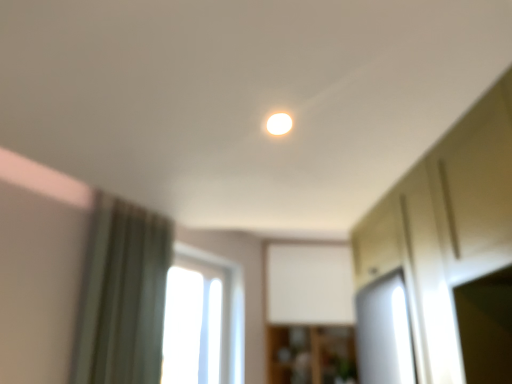
The image size is (512, 384). Identify the location of matte white light at center. (279, 124).

Image resolution: width=512 pixels, height=384 pixels. What are the coordinates of `green fabric curtain at left` in the screenshot? It's located at (123, 295).

In order to face transparent glass window at center, should I rotate leftwards or rightwards?

Turn left approximately 7.217 degrees to face it.

What are the coordinates of `matte white light at center` in the screenshot? It's located at (279, 124).

Does point (129, 253) come farther from viewer compared to point (177, 308)?

No, (129, 253) is closer to viewer.

Considering the relative sizes of green fabric curtain at left and transparent glass window at center in the image provided, is green fabric curtain at left wider than transparent glass window at center?

Yes.

Is transparent glass window at center located within green fabric curtain at left?

No, transparent glass window at center is located outside of green fabric curtain at left.

Can you confirm if green fabric curtain at left is smaller than transparent glass window at center?

No, green fabric curtain at left is not smaller than transparent glass window at center.

Can you confirm if wooden cabinet at center is taller than matte white light at center?

Yes, wooden cabinet at center is taller than matte white light at center.

From the image's perspective, is wooden cabinet at center beneath matte white light at center?

Yes, from the image's perspective, wooden cabinet at center is below matte white light at center.

Is wooden cabinet at center at the right side of matte white light at center?

Correct, you'll find wooden cabinet at center to the right of matte white light at center.

Does wooden cabinet at center have a larger size compared to matte white light at center?

Indeed, wooden cabinet at center has a larger size compared to matte white light at center.

Is matte white light at center oriented towards green fabric curtain at left?

No, matte white light at center is not oriented towards green fabric curtain at left.

Locate an element on the screen. The width and height of the screenshot is (512, 384). light above the green fabric curtain at left (from the image's perspective) is located at coordinates (279, 124).

Would you say matte white light at center is to the left or to the right of green fabric curtain at left in the picture?

Clearly, matte white light at center is on the right of green fabric curtain at left in the image.

Who is smaller, matte white light at center or transparent glass window at center?

Smaller between the two is matte white light at center.

How different are the orientations of matte white light at center and transparent glass window at center in degrees?

The facing directions of matte white light at center and transparent glass window at center are 145 degrees apart.

Looking at their sizes, would you say matte white light at center is wider or thinner than transparent glass window at center?

In the image, matte white light at center appears to be wider than transparent glass window at center.

From a real-world perspective, who is located higher, matte white light at center or transparent glass window at center?

In real-world perspective, matte white light at center is above.

Is transparent glass window at center further to the viewer compared to wooden cabinet at center?

No, transparent glass window at center is in front of wooden cabinet at center.

In the scene shown: How different are the orientations of transparent glass window at center and wooden cabinet at center in degrees?

There is a 55.4-degree angle between the facing directions of transparent glass window at center and wooden cabinet at center.

Between transparent glass window at center and wooden cabinet at center, which one appears on the right side from the viewer's perspective?

wooden cabinet at center.

From a real-world perspective, is transparent glass window at center positioned under wooden cabinet at center based on gravity?

Actually, transparent glass window at center is physically above wooden cabinet at center in the real world.

Considering the sizes of objects transparent glass window at center and matte white light at center in the image provided, who is smaller, transparent glass window at center or matte white light at center?

matte white light at center is smaller.

From a real-world perspective, which is physically above, transparent glass window at center or matte white light at center?

matte white light at center, from a real-world perspective.

Identify the location of window on the left of matte white light at center. (203, 320).

Is point (87, 270) positioned in front of point (336, 369)?

Yes, point (87, 270) is closer to viewer.

In terms of height, does green fabric curtain at left look taller or shorter compared to wooden cabinet at center?

green fabric curtain at left is taller than wooden cabinet at center.

How different are the orientations of green fabric curtain at left and wooden cabinet at center in degrees?

The angle between the facing direction of green fabric curtain at left and the facing direction of wooden cabinet at center is 53.6 degrees.

From a real-world perspective, is green fabric curtain at left beneath wooden cabinet at center?

Incorrect, from a real-world perspective, green fabric curtain at left is higher than wooden cabinet at center.

In order to click on curtain in front of the transparent glass window at center in this screenshot , I will do `click(123, 295)`.

Locate an element on the screen. cabinetry beneath the matte white light at center (from a real-world perspective) is located at coordinates (311, 355).

From the image, which object appears to be farther from transparent glass window at center, green fabric curtain at left or wooden cabinet at center?

green fabric curtain at left is further to transparent glass window at center.

Based on their spatial positions, is transparent glass window at center or green fabric curtain at left further from wooden cabinet at center?

green fabric curtain at left.

Considering their positions, is wooden cabinet at center positioned closer to transparent glass window at center than green fabric curtain at left?

wooden cabinet at center is positioned closer to the anchor transparent glass window at center.

Based on their spatial positions, is matte white light at center or transparent glass window at center further from green fabric curtain at left?

transparent glass window at center is positioned further to the anchor green fabric curtain at left.

Which object lies nearer to the anchor point matte white light at center, green fabric curtain at left or transparent glass window at center?

green fabric curtain at left lies closer to matte white light at center than the other object.

From the image, which object appears to be farther from matte white light at center, wooden cabinet at center or green fabric curtain at left?

wooden cabinet at center is positioned further to the anchor matte white light at center.

When comparing their distances from wooden cabinet at center, does matte white light at center or green fabric curtain at left seem further?

matte white light at center is further to wooden cabinet at center.

Which object lies nearer to the anchor point transparent glass window at center, matte white light at center or green fabric curtain at left?

The object closer to transparent glass window at center is green fabric curtain at left.

The height and width of the screenshot is (384, 512). I want to click on curtain positioned between matte white light at center and transparent glass window at center from near to far, so click(x=123, y=295).

Identify the location of window between green fabric curtain at left and wooden cabinet at center along the z-axis. [203, 320].

Image resolution: width=512 pixels, height=384 pixels. Identify the location of window located between matte white light at center and wooden cabinet at center in the depth direction. (203, 320).

Locate an element on the screen. The height and width of the screenshot is (384, 512). curtain positioned between matte white light at center and wooden cabinet at center from near to far is located at coordinates (123, 295).